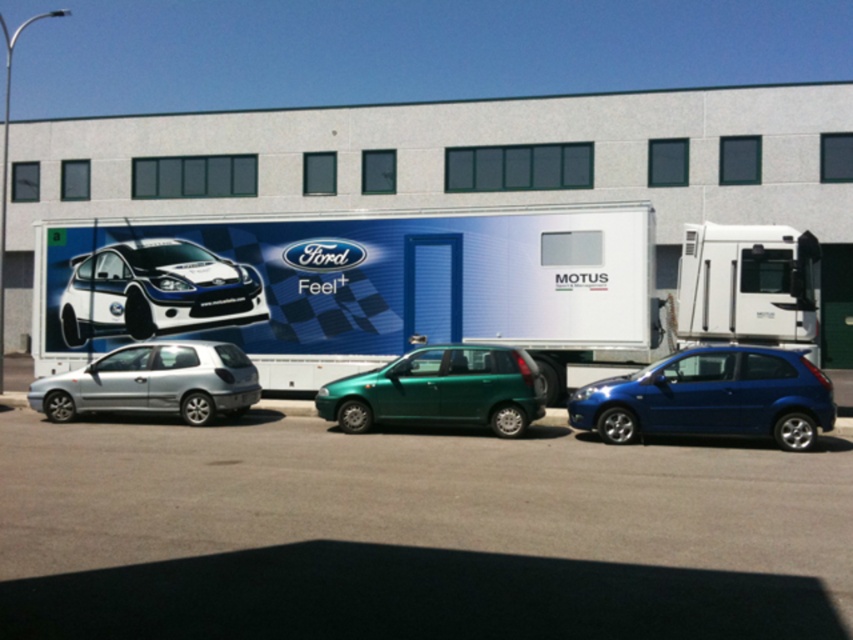
Measure the distance from white glossy truck at center to silver metallic hatchback at left.

A distance of 4.83 meters exists between white glossy truck at center and silver metallic hatchback at left.

Between white glossy truck at center and silver metallic hatchback at left, which one has less height?

silver metallic hatchback at left

Where is `white glossy truck at center`? The width and height of the screenshot is (853, 640). white glossy truck at center is located at coordinates (419, 288).

Does blue metallic hatchback at right have a greater height compared to silver metallic hatchback at left?

Indeed, blue metallic hatchback at right has a greater height compared to silver metallic hatchback at left.

Is blue metallic hatchback at right in front of silver metallic hatchback at left?

Yes, it is.

Does point (682, 417) come farther from viewer compared to point (41, 385)?

No, it is in front of (41, 385).

Image resolution: width=853 pixels, height=640 pixels. Identify the location of blue metallic hatchback at right. [x=711, y=397].

Who is more forward, (363,449) or (722,396)?

Point (363,449) is more forward.

What are the coordinates of `metallic silver car at center` in the screenshot? It's located at (413, 534).

What are the coordinates of `metallic silver car at center` in the screenshot? It's located at (413, 534).